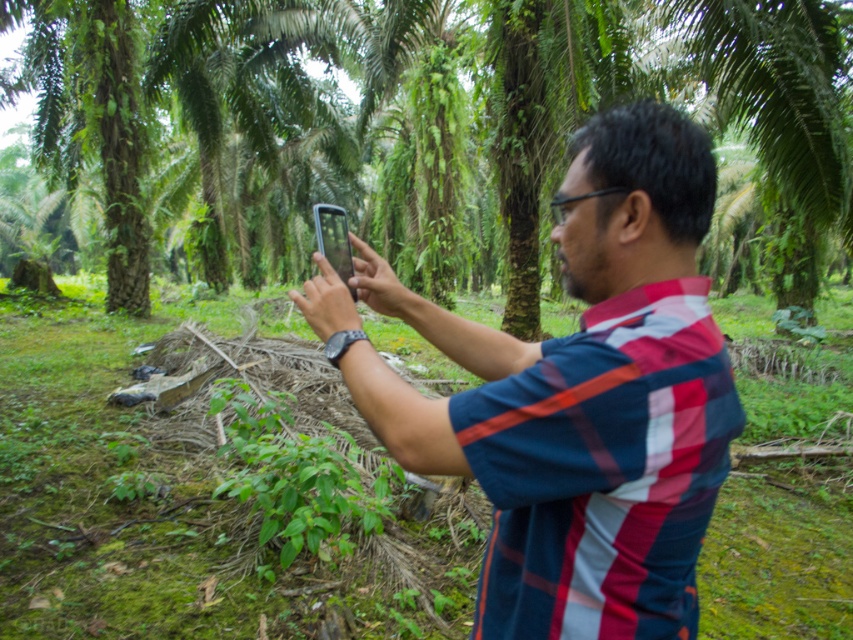
Question: Can you confirm if green leafy tree at center is positioned to the left of plaid shirt at center?

Choices:
 (A) no
 (B) yes

Answer: (B)

Question: Which point is closer to the camera taking this photo?

Choices:
 (A) (322, 168)
 (B) (621, 259)

Answer: (B)

Question: Is green leafy tree at center to the right of plaid shirt at center from the viewer's perspective?

Choices:
 (A) yes
 (B) no

Answer: (B)

Question: Does green leafy tree at center appear on the right side of plaid shirt at center?

Choices:
 (A) no
 (B) yes

Answer: (A)